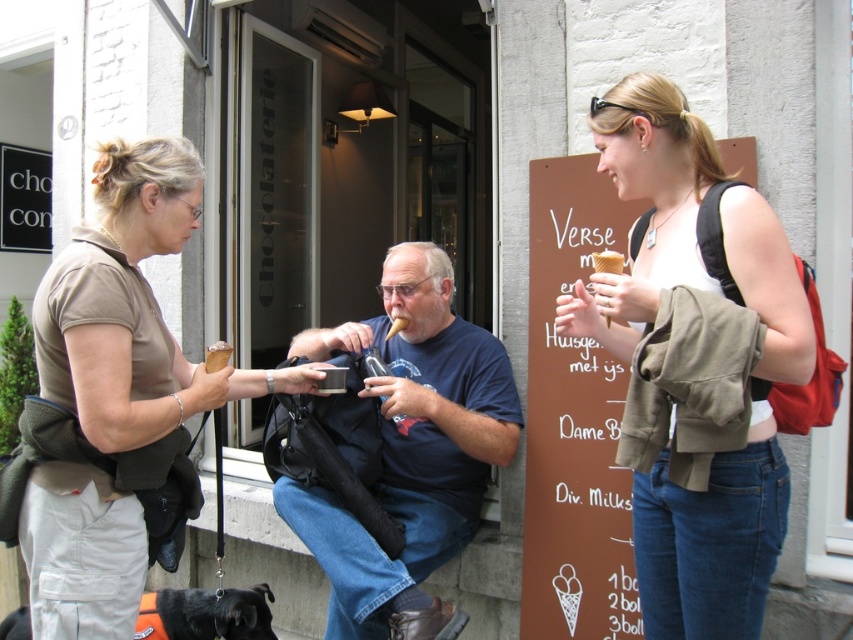
Who is shorter, matte brown shirt at left or dark blue t-shirt at center?

With less height is matte brown shirt at left.

How much distance is there between matte brown shirt at left and dark blue t-shirt at center?

They are 24.89 inches apart.

Is point (44, 570) closer to viewer compared to point (300, 353)?

Yes, point (44, 570) is closer to viewer.

You are a GUI agent. You are given a task and a screenshot of the screen. Output one action in this format:
    pyautogui.click(x=<x>, y=<y>)
    Task: Click on the matte brown shirt at left
    The width and height of the screenshot is (853, 640).
    Given the screenshot: What is the action you would take?
    pyautogui.click(x=132, y=307)

Does matte white ice cream cone at center appear over dark blue t-shirt at center?

Yes, matte white ice cream cone at center is above dark blue t-shirt at center.

Is matte white ice cream cone at center positioned at the back of dark blue t-shirt at center?

That is False.

This screenshot has height=640, width=853. I want to click on matte white ice cream cone at center, so click(x=747, y=381).

Who is shorter, matte white ice cream cone at center or matte brown shirt at left?

matte brown shirt at left is shorter.

Based on the photo, who is more forward, (751, 508) or (160, 198)?

Point (751, 508) is in front.

What do you see at coordinates (747, 381) in the screenshot? Image resolution: width=853 pixels, height=640 pixels. I see `matte white ice cream cone at center` at bounding box center [747, 381].

Where is `matte white ice cream cone at center`? The width and height of the screenshot is (853, 640). matte white ice cream cone at center is located at coordinates (747, 381).